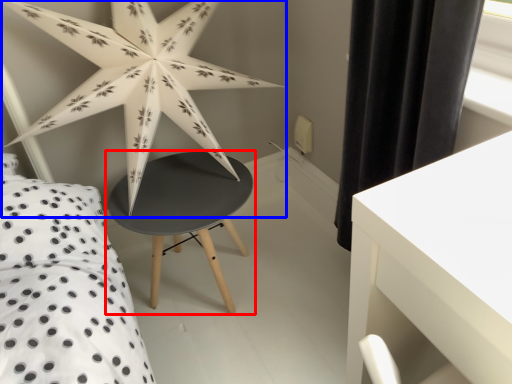
Question: Which object is further to the camera taking this photo, table (highlighted by a red box) or star (highlighted by a blue box)?

Choices:
 (A) table
 (B) star

Answer: (A)